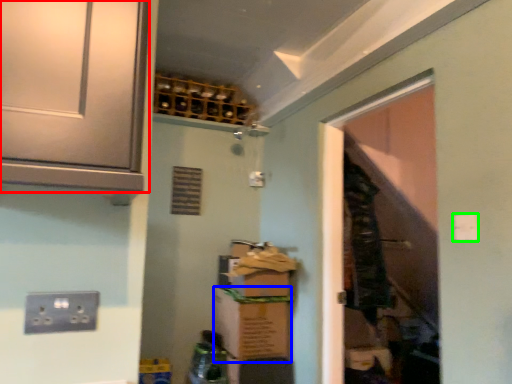
Question: Which is nearer to the cabinetry (highlighted by a red box)? cardboard box (highlighted by a blue box) or light switch (highlighted by a green box).

Choices:
 (A) cardboard box
 (B) light switch

Answer: (B)